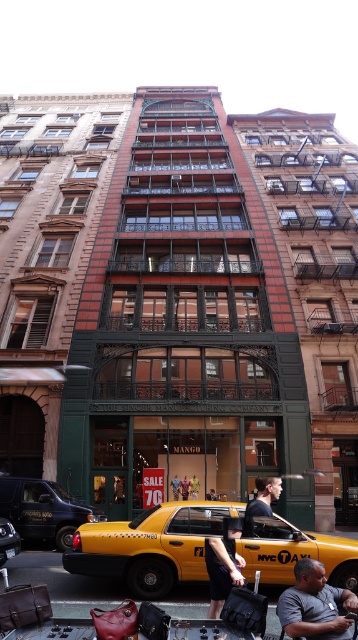
Question: Is yellow matte taxi at center positioned behind smooth leather handbags at lower center?

Choices:
 (A) yes
 (B) no

Answer: (A)

Question: Among these objects, which one is farthest from the camera?

Choices:
 (A) dark blue shirt at center
 (B) dark gray fabric pants at lower center

Answer: (A)

Question: Is yellow matte taxi at center positioned at the back of dark blue shirt at center?

Choices:
 (A) no
 (B) yes

Answer: (A)

Question: Which of the following is the farthest from the observer?

Choices:
 (A) smooth leather handbags at lower center
 (B) dark skin textured shirt at center
 (C) yellow matte taxi at center

Answer: (C)

Question: Where is dark gray fabric pants at lower center located in relation to dark blue shirt at center in the image?

Choices:
 (A) above
 (B) below

Answer: (A)

Question: Which object is the closest to the yellow matte taxi at center?

Choices:
 (A) dark skin textured shirt at center
 (B) dark blue shirt at center
 (C) smooth leather handbags at lower center
 (D) dark gray fabric pants at lower center

Answer: (C)